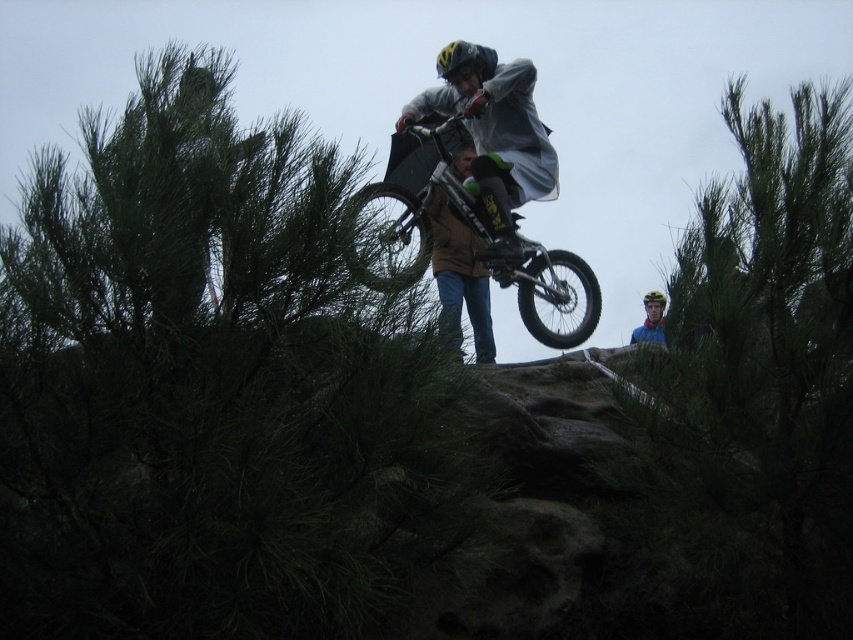
Question: Which point is closer to the camera taking this photo?

Choices:
 (A) (16, 323)
 (B) (550, 282)
 (C) (662, 326)

Answer: (A)

Question: Observing the image, what is the correct spatial positioning of green leafy tree at upper left in reference to shiny black mountain bike at center?

Choices:
 (A) above
 (B) below

Answer: (B)

Question: Can you confirm if green leafy tree at upper center is thinner than yellow matte helmet at upper center?

Choices:
 (A) no
 (B) yes

Answer: (A)

Question: Can you confirm if green leafy tree at upper center is positioned below shiny black mountain bike at center?

Choices:
 (A) yes
 (B) no

Answer: (A)

Question: Among these points, which one is nearest to the camera?

Choices:
 (A) (320, 444)
 (B) (704, 609)

Answer: (A)

Question: Which of the following is the closest to the observer?

Choices:
 (A) yellow matte helmet at upper center
 (B) green leafy tree at upper left

Answer: (B)